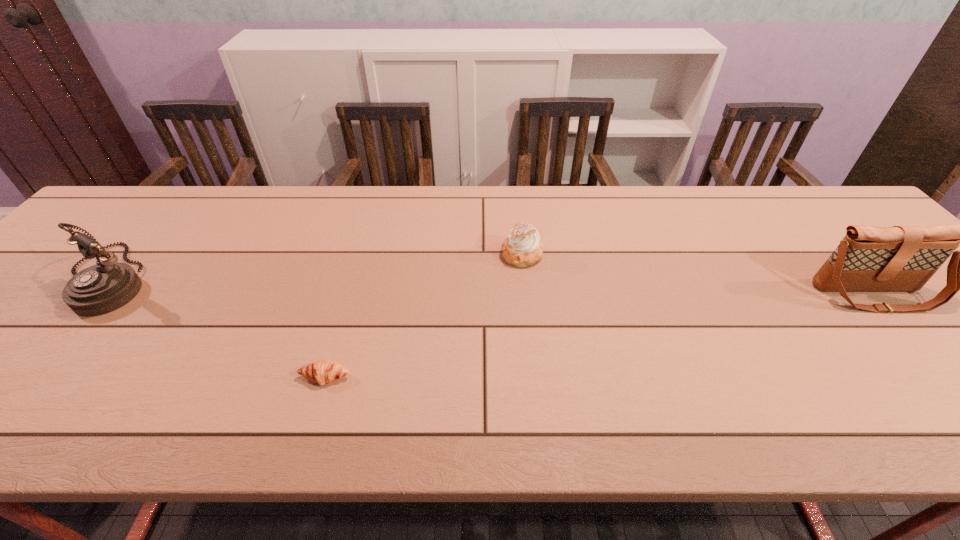
At what (x,y) coordinates should I click in order to perform the action: click on free space located on the back of the third object from left to right. Please return your answer as a coordinate pair (x, y). The width and height of the screenshot is (960, 540). Looking at the image, I should click on (516, 200).

Identify the location of vacant space located 0.090m on the front-facing side of the shortest object. (310, 431).

In order to click on object that is positioned at the left edge in this screenshot , I will do `click(102, 288)`.

Where is `object positioned at the right edge`? The height and width of the screenshot is (540, 960). object positioned at the right edge is located at coordinates (901, 258).

This screenshot has width=960, height=540. I want to click on vacant area at the far edge of the desktop, so click(447, 192).

Where is `vacant region at the near edge of the desktop`? This screenshot has width=960, height=540. vacant region at the near edge of the desktop is located at coordinates (687, 399).

Find the location of a particular element. This screenshot has height=540, width=960. vacant space at the right edge of the desktop is located at coordinates tap(945, 371).

Where is `vacant point at the far right corner`? The height and width of the screenshot is (540, 960). vacant point at the far right corner is located at coordinates (796, 198).

You are a GUI agent. You are given a task and a screenshot of the screen. Output one action in this format:
    pyautogui.click(x=<x>, y=<y>)
    Task: Click on the vacant space that's between the taller pastry and the telephone
    The image size is (960, 540).
    Given the screenshot: What is the action you would take?
    pyautogui.click(x=317, y=266)

Locate an element on the screen. The width and height of the screenshot is (960, 540). blank region between the telephone and the third object from left to right is located at coordinates (317, 266).